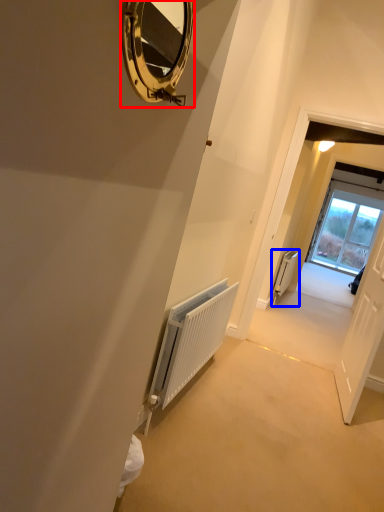
Question: Which object is further to the camera taking this photo, mirror (highlighted by a red box) or radiator (highlighted by a blue box)?

Choices:
 (A) mirror
 (B) radiator

Answer: (B)